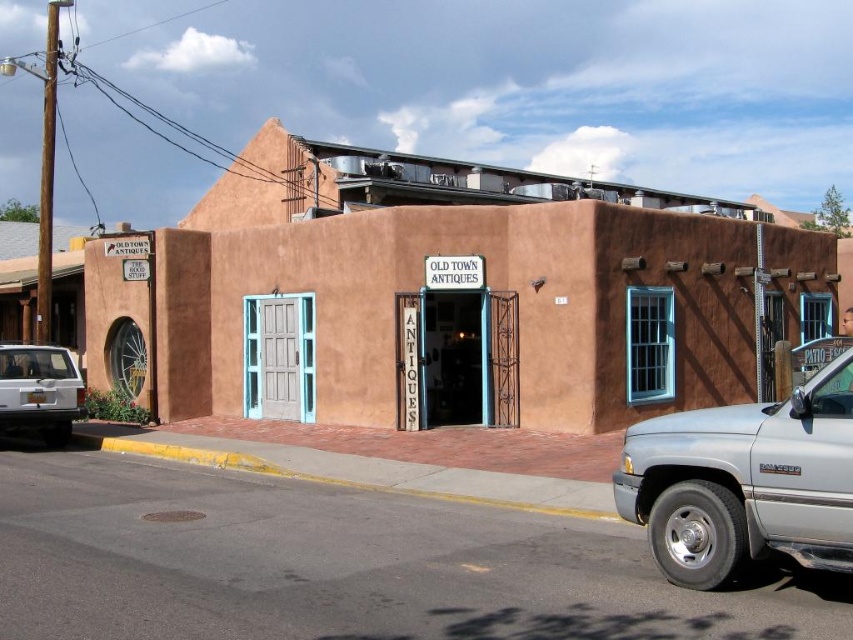
Question: Which of the following is the closest to the observer?

Choices:
 (A) (843, 563)
 (B) (38, 410)

Answer: (A)

Question: Which point appears farthest from the camera in this image?

Choices:
 (A) (36, 365)
 (B) (660, 477)

Answer: (A)

Question: In this image, where is silver metallic truck at right located relative to white matte suv at lower left?

Choices:
 (A) above
 (B) below

Answer: (A)

Question: Is silver metallic truck at right to the left of white matte suv at lower left from the viewer's perspective?

Choices:
 (A) yes
 (B) no

Answer: (B)

Question: Does silver metallic truck at right appear on the left side of white matte suv at lower left?

Choices:
 (A) yes
 (B) no

Answer: (B)